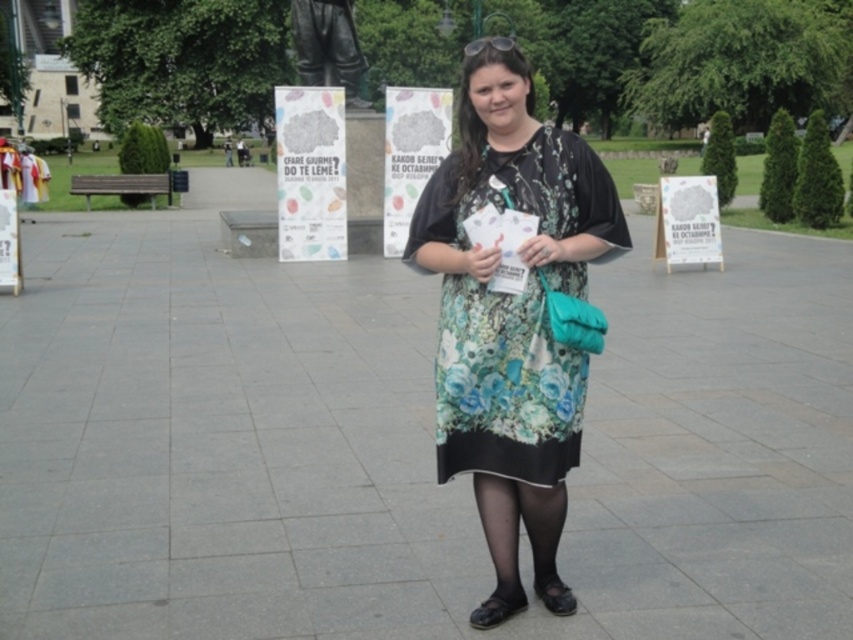
Question: Which point is farther to the camera?

Choices:
 (A) (328, 70)
 (B) (467, 296)

Answer: (A)

Question: Can you confirm if floral-patterned fabric dress at center is bigger than bronze statue at upper center?

Choices:
 (A) yes
 (B) no

Answer: (A)

Question: Observing the image, what is the correct spatial positioning of floral-patterned fabric dress at center in reference to bronze statue at upper center?

Choices:
 (A) below
 (B) above

Answer: (A)

Question: Does floral-patterned fabric dress at center have a smaller size compared to bronze statue at upper center?

Choices:
 (A) yes
 (B) no

Answer: (B)

Question: Among these points, which one is farthest from the camera?

Choices:
 (A) (563, 433)
 (B) (337, 13)

Answer: (B)